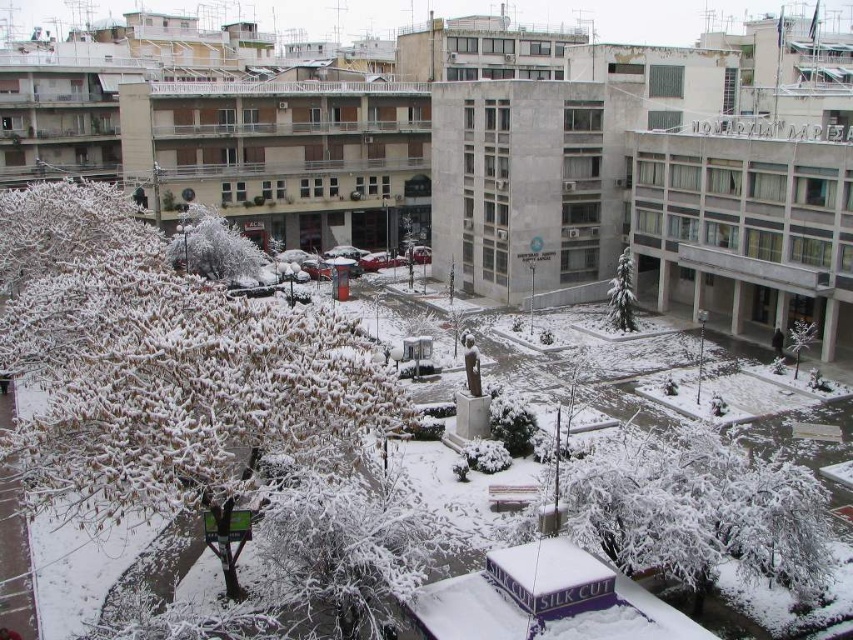
Question: Observing the image, what is the correct spatial positioning of green matte tree at center in reference to white frosted tree at center?

Choices:
 (A) right
 (B) left

Answer: (B)

Question: Estimate the real-world distances between objects in this image. Which object is closer to the green matte tree at center?

Choices:
 (A) white frosty tree at center
 (B) white frosted tree at center
 (C) white snow-covered tree at left

Answer: (B)

Question: Which point is closer to the camera?

Choices:
 (A) green matte tree at center
 (B) white frosty tree at center

Answer: (A)

Question: Does white frosty tree at center have a larger size compared to green matte tree at center?

Choices:
 (A) no
 (B) yes

Answer: (B)

Question: Which of the following is the farthest from the observer?

Choices:
 (A) white snow-covered tree at left
 (B) green matte tree at center

Answer: (B)

Question: Does green matte tree at center come behind white frosted tree at center?

Choices:
 (A) no
 (B) yes

Answer: (B)